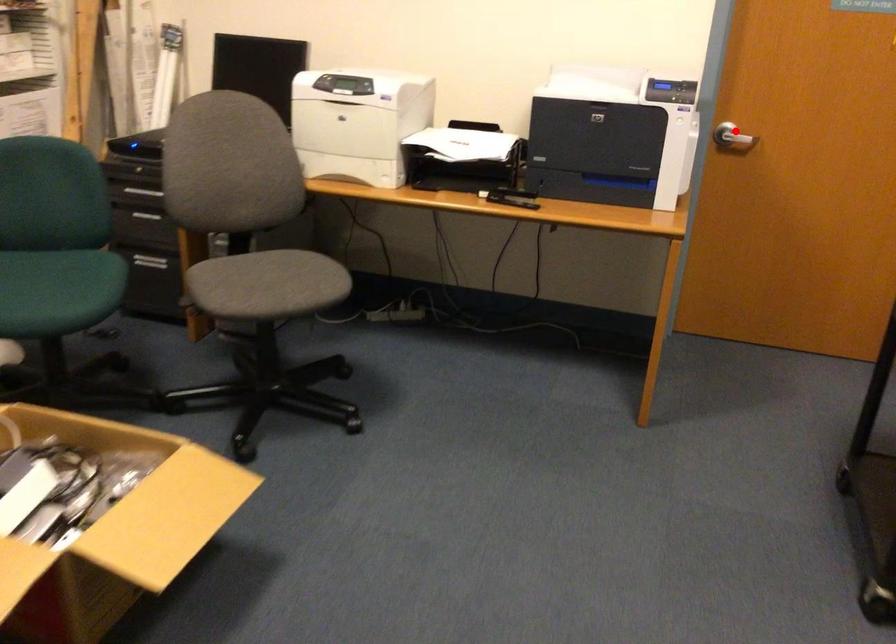
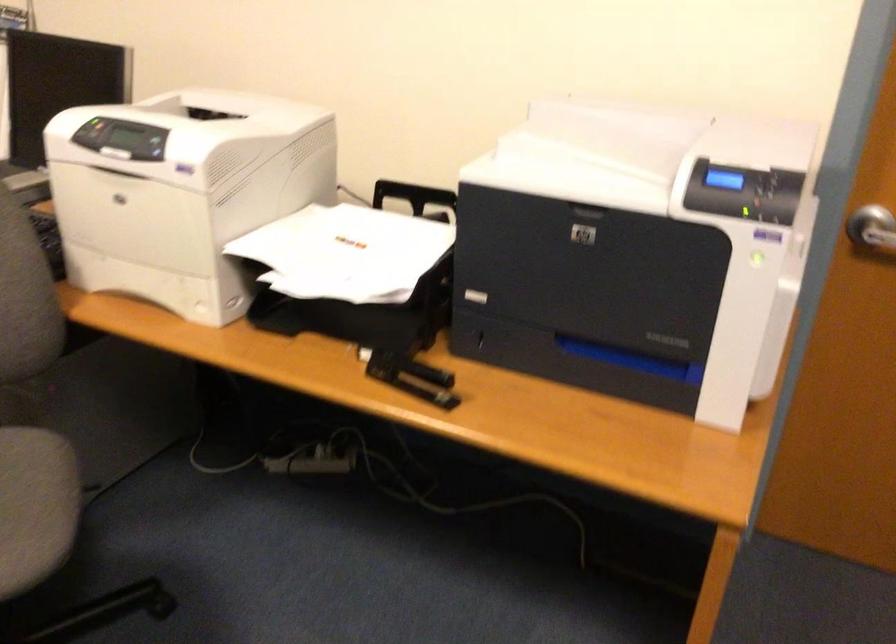
Where in the second image is the point corresponding to the highlighted location from the first image?

(872, 230)